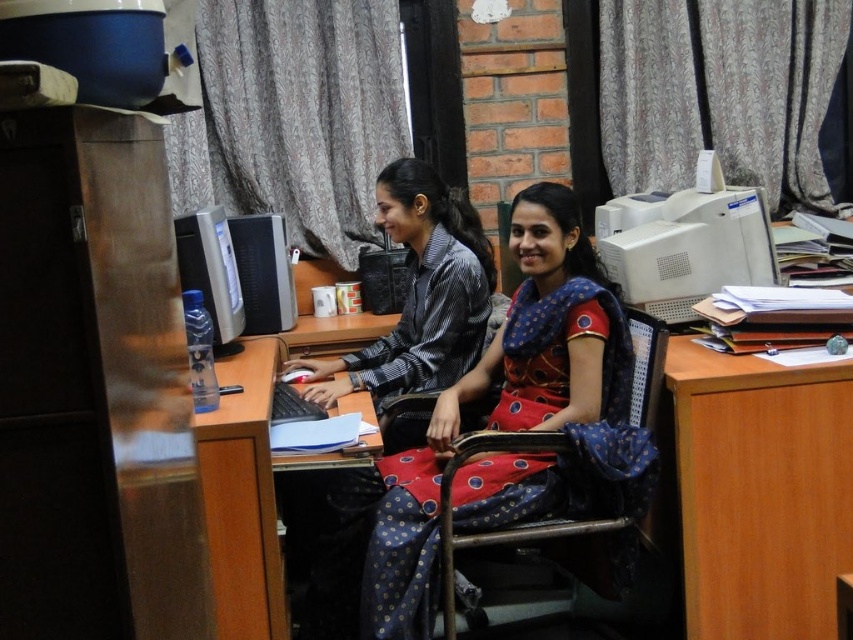
Is red fabric saree at center shorter than satin black monitor at center?

No.

Between point (465, 472) and point (248, 259), which one is positioned in front?

Point (465, 472) is more forward.

Locate an element on the screen. This screenshot has width=853, height=640. red fabric saree at center is located at coordinates (515, 420).

Is point (563, 371) closer to viewer compared to point (444, 545)?

No.

Looking at this image, does red fabric saree at center have a lesser height compared to metallic blue chair at center?

In fact, red fabric saree at center may be taller than metallic blue chair at center.

Find the location of `red fabric saree at center`. red fabric saree at center is located at coordinates point(515,420).

Does wooden at right appear on the left side of satin black monitor at center?

No, wooden at right is not to the left of satin black monitor at center.

Is point (704, 454) less distant than point (242, 284)?

Yes, point (704, 454) is in front of point (242, 284).

You are a GUI agent. You are given a task and a screenshot of the screen. Output one action in this format:
    pyautogui.click(x=<x>, y=<y>)
    Task: Click on the wooden at right
    
    Given the screenshot: What is the action you would take?
    pyautogui.click(x=759, y=492)

Identify the location of wooden at right. The height and width of the screenshot is (640, 853). (759, 492).